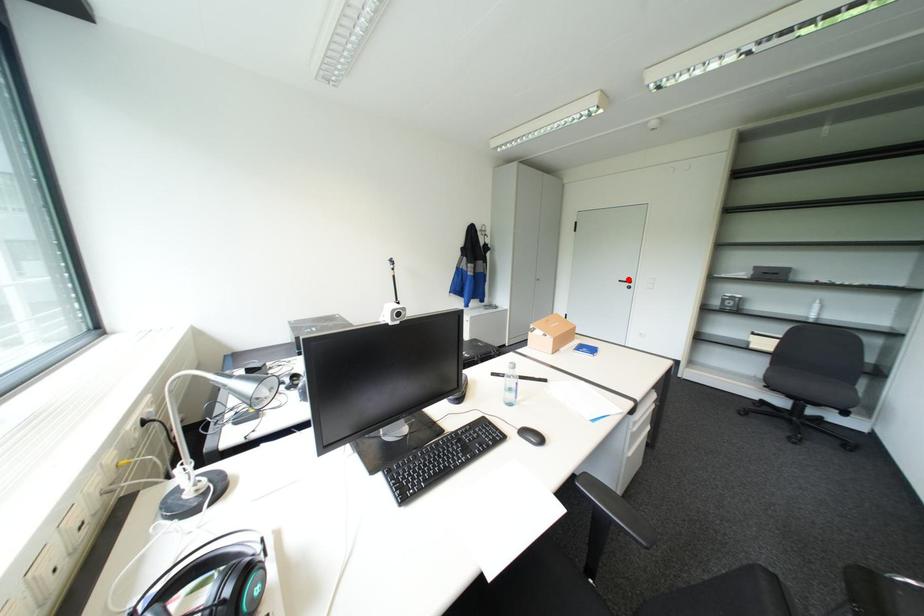
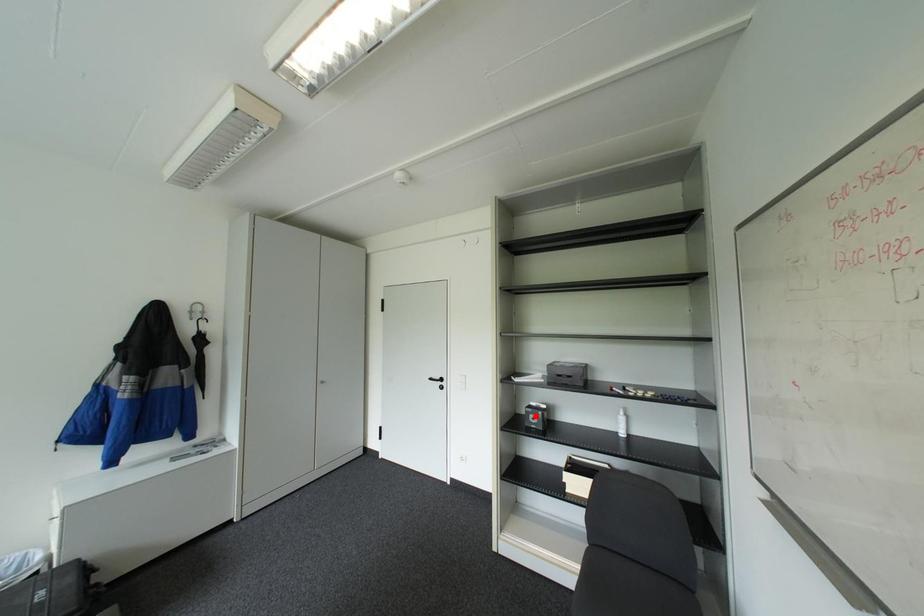
I am providing you with two images of the same scene from different viewpoints. A red point is marked on the first image and another point is marked on the second image. Do the highlighted points in image1 and image2 indicate the same real-world spot?

No